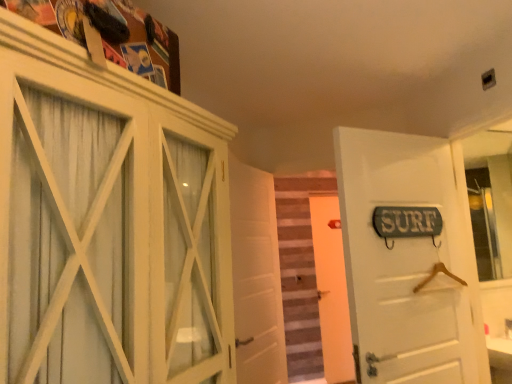
Question: From the image's perspective, is wooden stairs at center on top of white wood cabinet at upper left?

Choices:
 (A) yes
 (B) no

Answer: (B)

Question: Would you say white wood cabinet at upper left is part of wooden stairs at center's contents?

Choices:
 (A) no
 (B) yes

Answer: (A)

Question: Considering the relative sizes of wooden stairs at center and white wood cabinet at upper left in the image provided, is wooden stairs at center shorter than white wood cabinet at upper left?

Choices:
 (A) yes
 (B) no

Answer: (B)

Question: Does wooden stairs at center have a smaller size compared to white wood cabinet at upper left?

Choices:
 (A) no
 (B) yes

Answer: (B)

Question: Considering the relative sizes of wooden stairs at center and white wood cabinet at upper left in the image provided, is wooden stairs at center wider than white wood cabinet at upper left?

Choices:
 (A) yes
 (B) no

Answer: (B)

Question: Does wooden stairs at center come behind white wood cabinet at upper left?

Choices:
 (A) yes
 (B) no

Answer: (A)

Question: Is white matte door at center, the second door viewed from the back, in front of white wooden door at center, arranged as the third door when viewed from the front?

Choices:
 (A) yes
 (B) no

Answer: (A)

Question: Considering the relative sizes of white matte door at center, the 2th door when ordered from front to back, and white wooden door at center, arranged as the third door when viewed from the front, in the image provided, is white matte door at center, the 2th door when ordered from front to back, thinner than white wooden door at center, arranged as the third door when viewed from the front,?

Choices:
 (A) no
 (B) yes

Answer: (A)

Question: Can we say white matte door at center, the 2th door when ordered from front to back, lies outside white wooden door at center, which is the 1th door in back-to-front order?

Choices:
 (A) yes
 (B) no

Answer: (A)

Question: Can you confirm if white matte door at center, the 2th door when ordered from front to back, is shorter than white wooden door at center, arranged as the third door when viewed from the front?

Choices:
 (A) yes
 (B) no

Answer: (A)

Question: Is white wooden door at center, arranged as the third door when viewed from the front, at the back of white matte door at center, the second door viewed from the back?

Choices:
 (A) no
 (B) yes

Answer: (A)

Question: From the image's perspective, is white matte door at center, the 2th door when ordered from front to back, over white wooden door at center, arranged as the third door when viewed from the front?

Choices:
 (A) yes
 (B) no

Answer: (A)

Question: Can you confirm if white wooden door at center, which is the 1th door in back-to-front order, is smaller than white matte door at center, the second door viewed from the back?

Choices:
 (A) yes
 (B) no

Answer: (A)